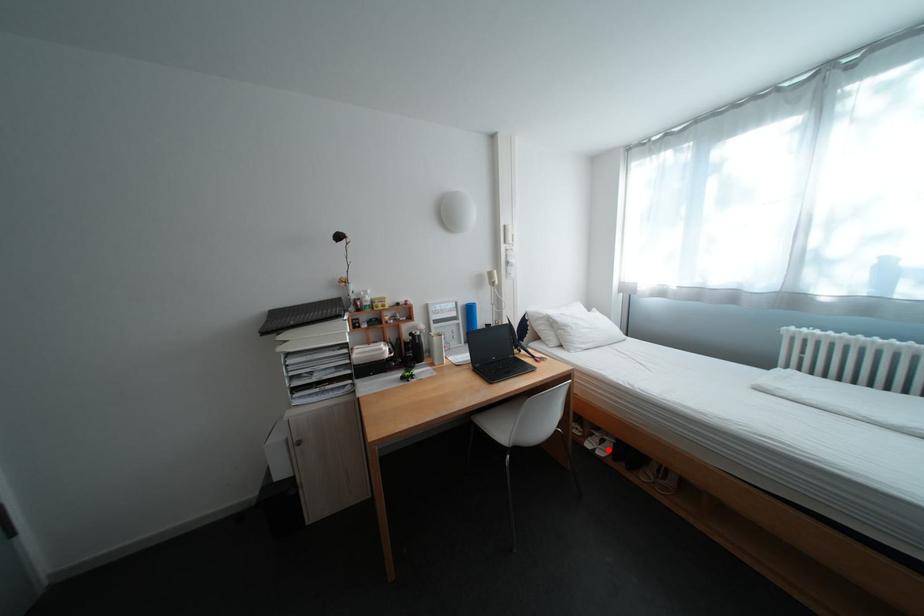
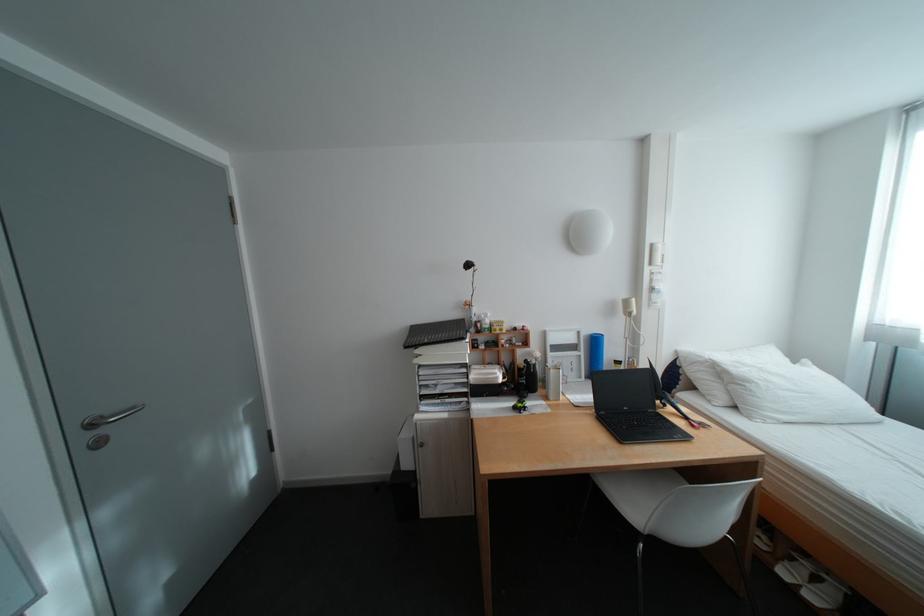
Question: I am providing you with two images of the same scene from different viewpoints. In image1, a red point is highlighted. Considering the same 3D point in image2, which of the following is correct?

Choices:
 (A) It is closer
 (B) It is farther

Answer: (A)